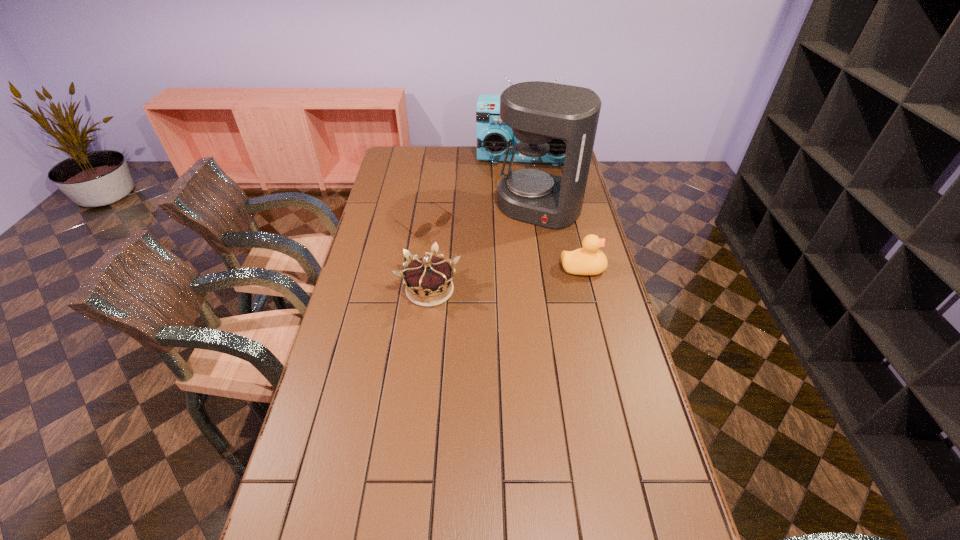
Locate an element on the screen. vacant space in between the radio receiver and the crown is located at coordinates (477, 224).

Where is `blank region between the tallest object and the crown`? The width and height of the screenshot is (960, 540). blank region between the tallest object and the crown is located at coordinates (485, 249).

You are a GUI agent. You are given a task and a screenshot of the screen. Output one action in this format:
    pyautogui.click(x=<x>, y=<y>)
    Task: Click on the unoccupied position between the shortest object and the duck
    
    Given the screenshot: What is the action you would take?
    pyautogui.click(x=503, y=246)

I want to click on free spot between the crown and the tallest object, so (x=485, y=249).

The height and width of the screenshot is (540, 960). Identify the location of object that is the third closest one to the coffee maker. (444, 218).

Where is `the fourth closest object to the shortest object`? The image size is (960, 540). the fourth closest object to the shortest object is located at coordinates (589, 260).

You are a GUI agent. You are given a task and a screenshot of the screen. Output one action in this format:
    pyautogui.click(x=<x>, y=<y>)
    Task: Click on the vacant area in the image that satisfies the following two spatial constraints: 1. on the front side of the farthest object; 2. on the face of the duck
    
    Given the screenshot: What is the action you would take?
    pyautogui.click(x=541, y=268)

Where is `vacant area that satisfies the following two spatial constraints: 1. on the front side of the crown; 2. on the left side of the shortest object`? The height and width of the screenshot is (540, 960). vacant area that satisfies the following two spatial constraints: 1. on the front side of the crown; 2. on the left side of the shortest object is located at coordinates (414, 290).

Locate an element on the screen. Image resolution: width=960 pixels, height=540 pixels. free point that satisfies the following two spatial constraints: 1. on the front side of the duck; 2. on the face of the shortest object is located at coordinates (417, 268).

Identify the location of free space that satisfies the following two spatial constraints: 1. on the front side of the duck; 2. on the face of the tallest object. (549, 268).